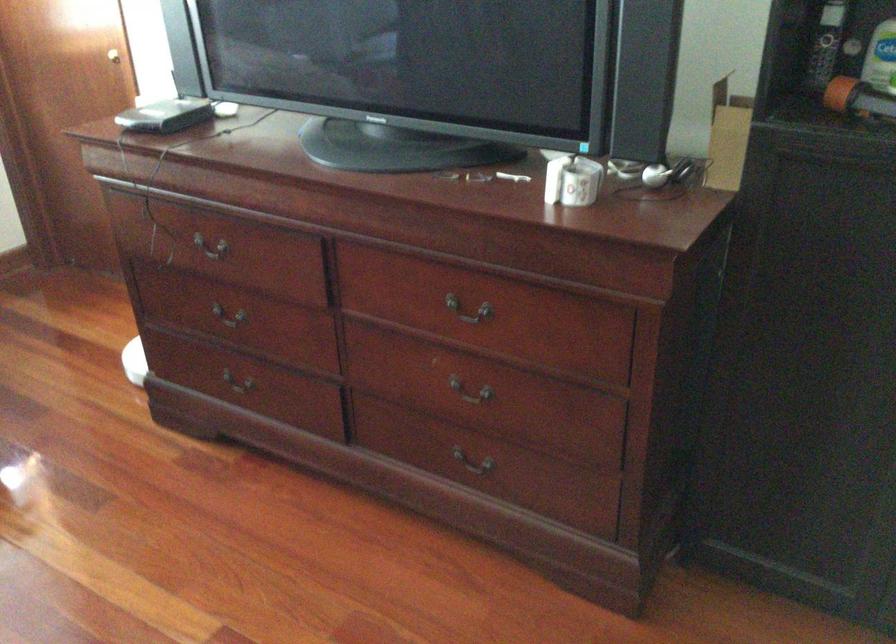
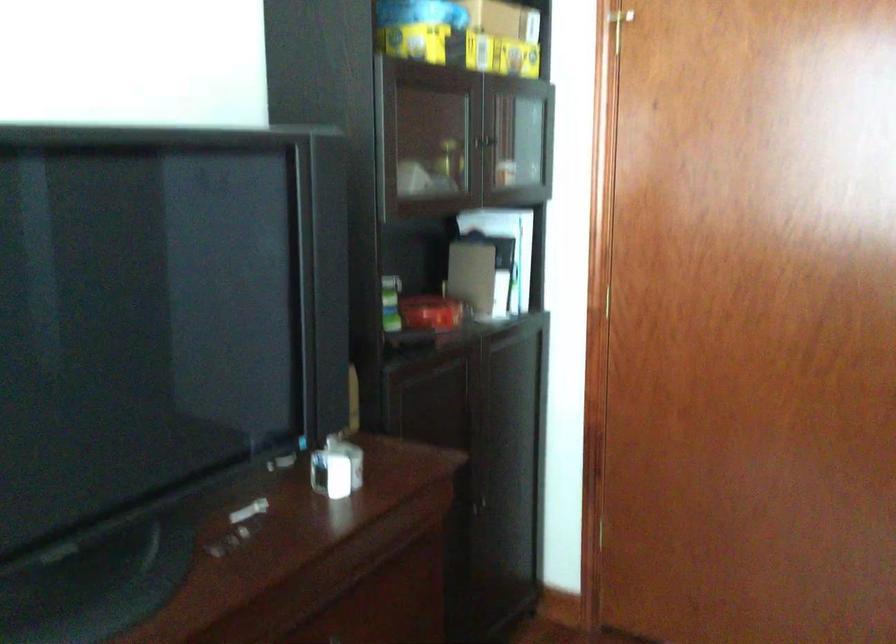
Question: I am providing you with two images of the same scene from different viewpoints. Please identify which objects are invisible in image2.

Choices:
 (A) red tin box
 (B) green top bottle
 (C) white detergent bottle
 (D) cabinet handle

Answer: (B)